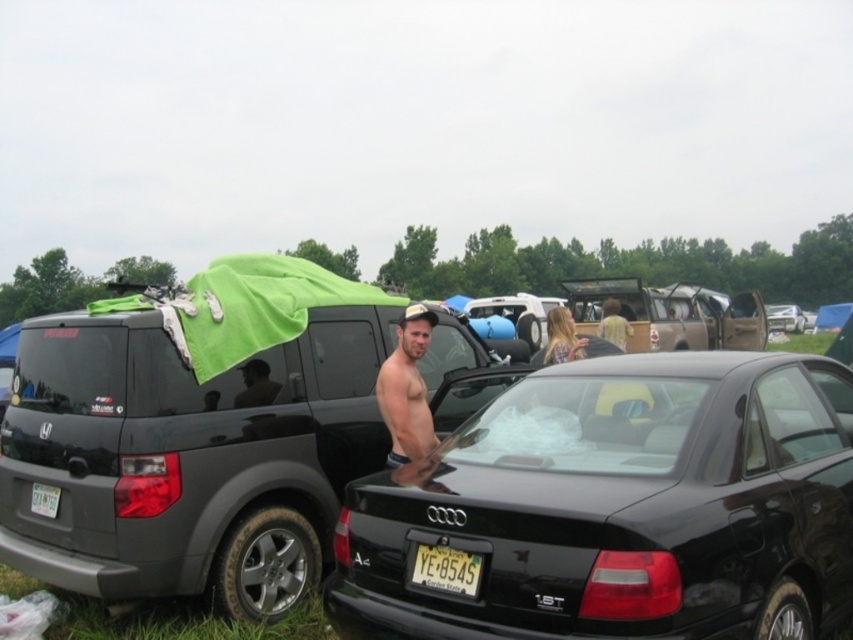
Which is behind, point (108, 346) or point (413, 579)?

The point (108, 346) is more distant.

Based on the photo, can you confirm if matte black suv at center is wider than yellow matte license plate at center?

Yes, matte black suv at center is wider than yellow matte license plate at center.

Which is behind, point (276, 273) or point (416, 552)?

The point (276, 273) is more distant.

Identify the location of matte black suv at center. (194, 444).

What do you see at coordinates (407, 388) in the screenshot? This screenshot has width=853, height=640. I see `skinny man at center` at bounding box center [407, 388].

Is point (405, 348) in front of point (618, 305)?

Yes.

Who is more distant from viewer, (407, 412) or (611, 308)?

The point (611, 308) is behind.

This screenshot has width=853, height=640. I want to click on skinny man at center, so click(x=407, y=388).

Which is more to the left, black glossy sedan at center or yellow matte license plate at center?

Positioned to the left is yellow matte license plate at center.

Is black glossy sedan at center to the right of yellow matte license plate at center from the viewer's perspective?

Yes, black glossy sedan at center is to the right of yellow matte license plate at center.

Is point (399, 605) positioned behind point (462, 556)?

Yes, point (399, 605) is behind point (462, 556).

Locate an element on the screen. This screenshot has width=853, height=640. black glossy sedan at center is located at coordinates (619, 508).